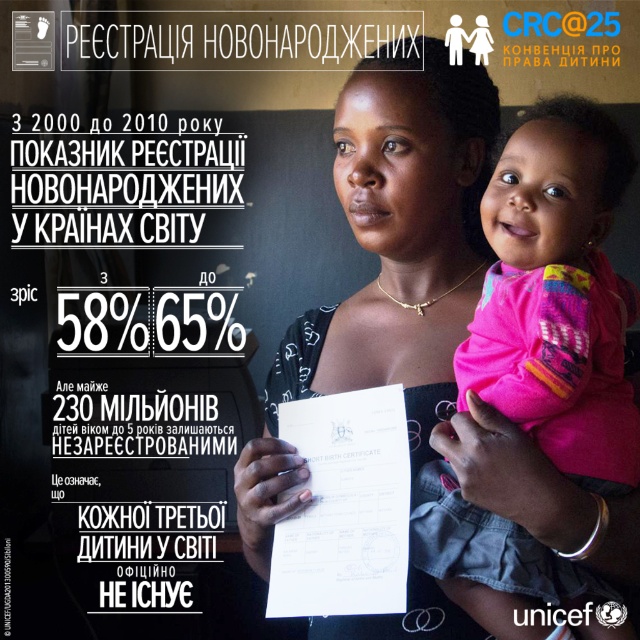
Question: Can you confirm if pink fabric baby at center is positioned to the left of white paper at center?

Choices:
 (A) yes
 (B) no

Answer: (B)

Question: Does pink fabric baby at center have a greater width compared to white paper at center?

Choices:
 (A) no
 (B) yes

Answer: (B)

Question: Is the position of pink fabric baby at center less distant than that of white paper at center?

Choices:
 (A) yes
 (B) no

Answer: (A)

Question: Which point is closer to the camera taking this photo?

Choices:
 (A) (582, 333)
 (B) (369, 541)

Answer: (A)

Question: Which point is closer to the camera?

Choices:
 (A) (524, 186)
 (B) (387, 403)

Answer: (A)